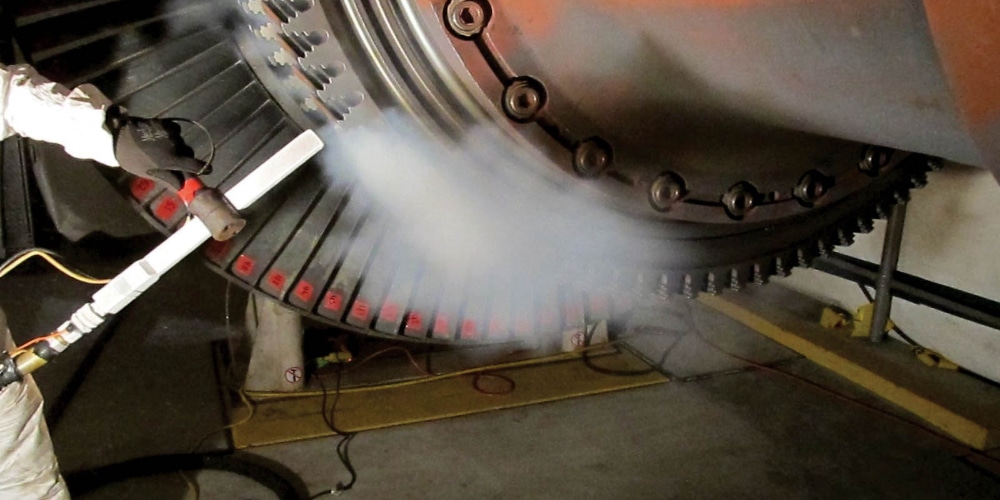
Image resolution: width=1000 pixels, height=500 pixels. Identify the location of gray concrete floor. (643, 469).